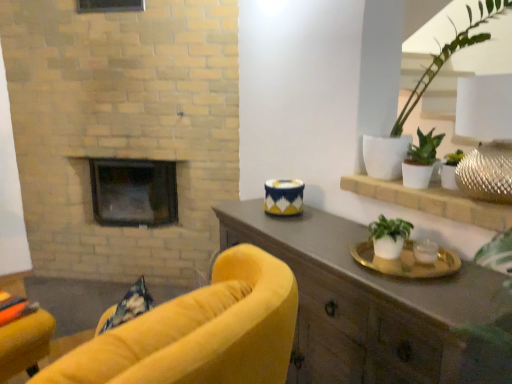
What are the coordinates of `free space in front of blue and white ceramic candle holder at center` in the screenshot? It's located at (273, 223).